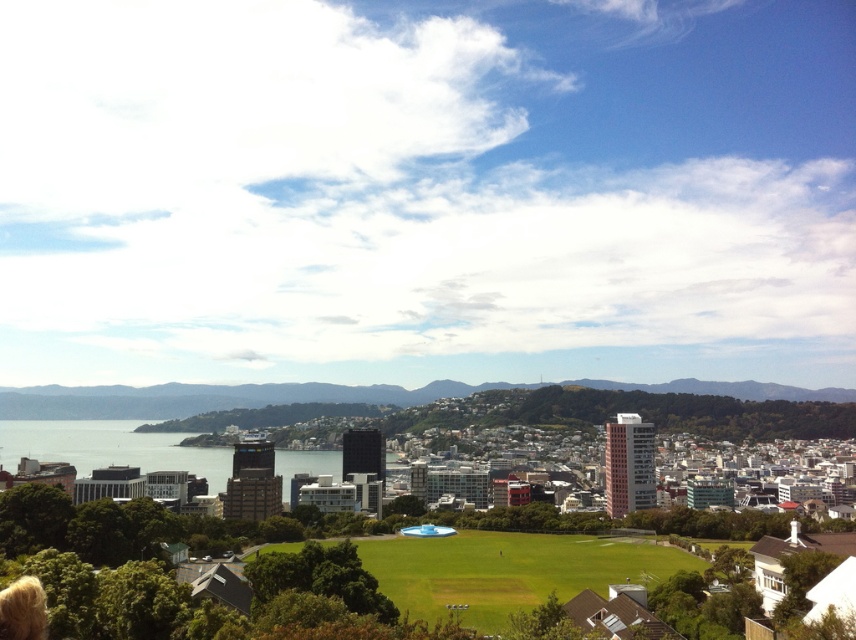
Question: Can you confirm if green grass field at center is positioned to the right of transparent glass water at center?

Choices:
 (A) no
 (B) yes

Answer: (B)

Question: Among these objects, which one is nearest to the camera?

Choices:
 (A) green grass field at center
 (B) transparent glass water at center

Answer: (A)

Question: Which object appears farthest from the camera in this image?

Choices:
 (A) green grass field at center
 (B) transparent glass water at center

Answer: (B)

Question: Does green grass field at center appear on the left side of transparent glass water at center?

Choices:
 (A) yes
 (B) no

Answer: (B)

Question: Is green grass field at center in front of transparent glass water at center?

Choices:
 (A) no
 (B) yes

Answer: (B)

Question: Among these objects, which one is nearest to the camera?

Choices:
 (A) transparent glass water at center
 (B) green grass field at center

Answer: (B)